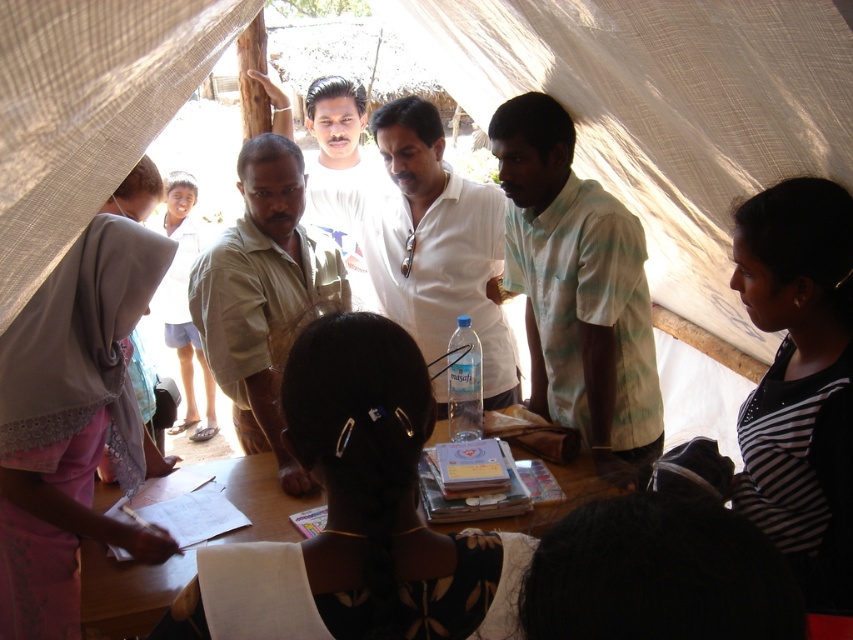
From the picture: Between light beige shirt at center and white matte shirt at center, which one appears on the left side from the viewer's perspective?

Positioned to the left is light beige shirt at center.

Is point (223, 237) closer to camera compared to point (457, 216)?

That is True.

Locate an element on the screen. The width and height of the screenshot is (853, 640). light beige shirt at center is located at coordinates (263, 294).

Does green striped shirt at center have a lesser height compared to wooden table at center?

In fact, green striped shirt at center may be taller than wooden table at center.

From the picture: Is green striped shirt at center taller than wooden table at center?

Yes, green striped shirt at center is taller than wooden table at center.

The image size is (853, 640). Find the location of `green striped shirt at center`. green striped shirt at center is located at coordinates (578, 291).

In order to click on green striped shirt at center in this screenshot , I will do `click(578, 291)`.

Who is more forward, (611, 428) or (161, 220)?

Point (611, 428) is in front.

Which is more to the right, green striped shirt at center or light brown skin at center?

green striped shirt at center

Between point (653, 451) and point (171, 428), which one is positioned in front?

Positioned in front is point (653, 451).

This screenshot has width=853, height=640. In order to click on green striped shirt at center in this screenshot , I will do `click(578, 291)`.